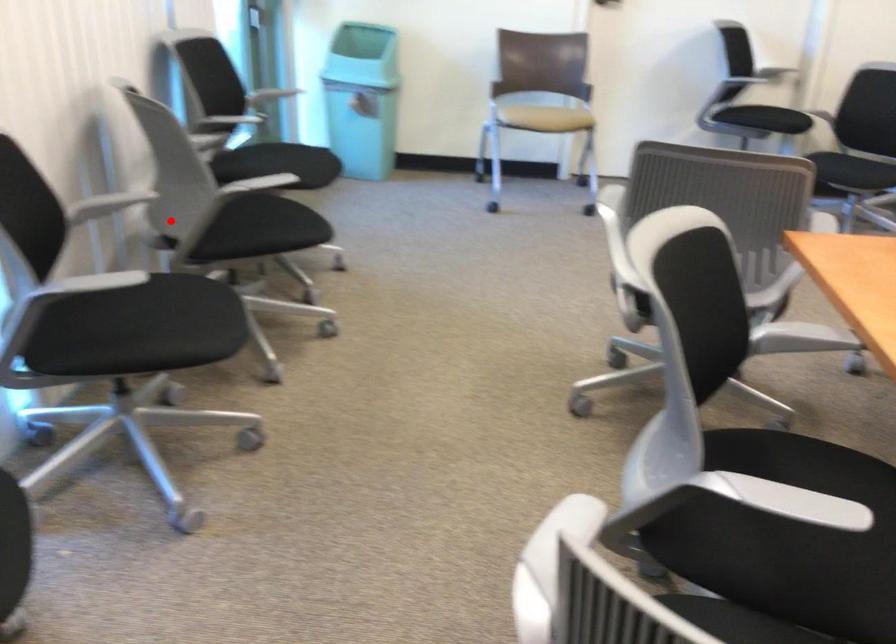
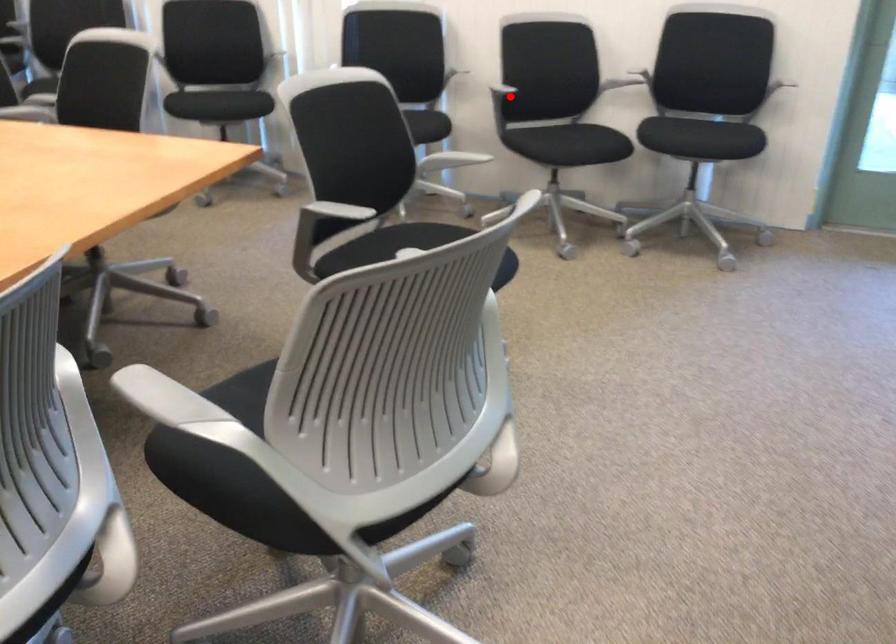
I am providing you with two images of the same scene from different viewpoints. A red point is marked on the first image and another point is marked on the second image. Does the point marked in image1 correspond to the same location as the one in image2?

Yes